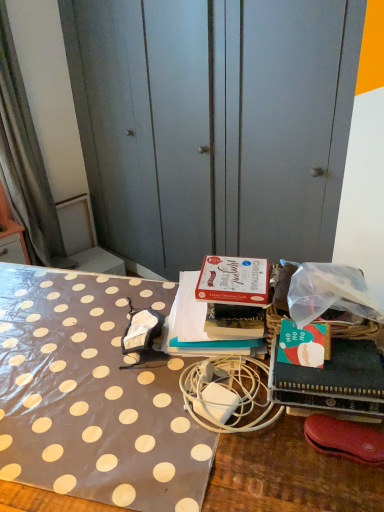
Question: Considering the relative positions of white matte charger at center and polka dot fabric at center in the image provided, is white matte charger at center to the left of polka dot fabric at center from the viewer's perspective?

Choices:
 (A) yes
 (B) no

Answer: (B)

Question: Is white matte charger at center positioned beyond the bounds of polka dot fabric at center?

Choices:
 (A) no
 (B) yes

Answer: (B)

Question: Is the position of white matte charger at center more distant than that of polka dot fabric at center?

Choices:
 (A) yes
 (B) no

Answer: (A)

Question: Is white matte charger at center taller than polka dot fabric at center?

Choices:
 (A) no
 (B) yes

Answer: (A)

Question: Is white matte charger at center positioned with its back to polka dot fabric at center?

Choices:
 (A) yes
 (B) no

Answer: (B)

Question: Is point [152, 67] positioned closer to the camera than point [240, 337]?

Choices:
 (A) farther
 (B) closer

Answer: (A)

Question: From their relative heights in the image, would you say polka dot fabric at left is taller or shorter than matte cardboard box at center, placed as the 2th book when sorted from front to back?

Choices:
 (A) tall
 (B) short

Answer: (A)

Question: From the image's perspective, is polka dot fabric at left above or below matte cardboard box at center, the 1th book in the back-to-front sequence?

Choices:
 (A) above
 (B) below

Answer: (A)

Question: Looking at their shapes, would you say polka dot fabric at left is wider or thinner than matte cardboard box at center, placed as the 2th book when sorted from front to back?

Choices:
 (A) wide
 (B) thin

Answer: (B)

Question: Is white matte charger at center wider or thinner than leather-like red shoe at lower right?

Choices:
 (A) wide
 (B) thin

Answer: (A)

Question: Visually, is white matte charger at center positioned to the left or to the right of leather-like red shoe at lower right?

Choices:
 (A) left
 (B) right

Answer: (A)

Question: Considering their positions, is white matte charger at center located in front of or behind leather-like red shoe at lower right?

Choices:
 (A) front
 (B) behind

Answer: (B)

Question: Is white matte charger at center spatially inside leather-like red shoe at lower right, or outside of it?

Choices:
 (A) inside
 (B) outside

Answer: (B)

Question: Is polka dot fabric at center in front of or behind matte cardboard box at center, the 1th book in the back-to-front sequence, in the image?

Choices:
 (A) front
 (B) behind

Answer: (A)

Question: Considering the positions of polka dot fabric at center and matte cardboard box at center, the 1th book in the back-to-front sequence, in the image, is polka dot fabric at center wider or thinner than matte cardboard box at center, the 1th book in the back-to-front sequence,?

Choices:
 (A) wide
 (B) thin

Answer: (A)